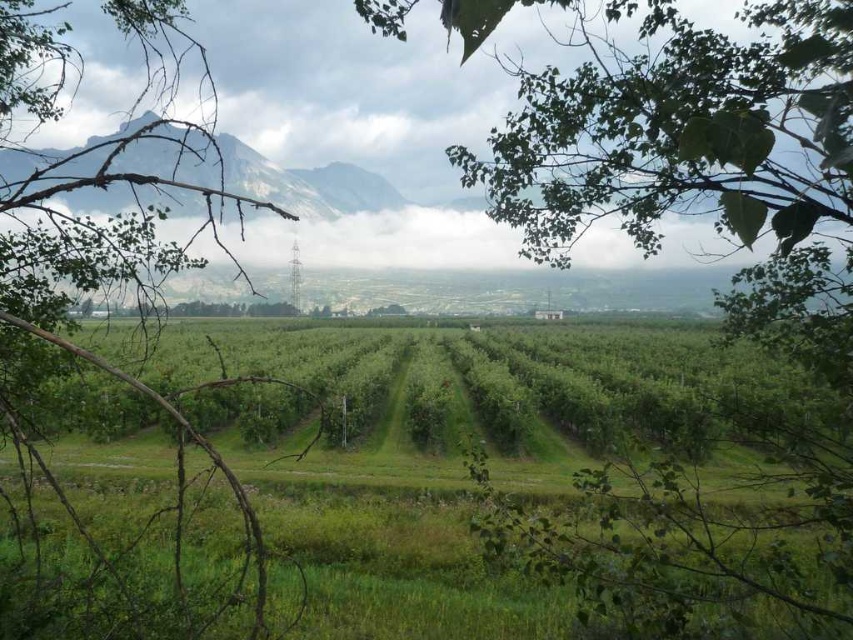
You are a GUI agent. You are given a task and a screenshot of the screen. Output one action in this format:
    pyautogui.click(x=<x>, y=<y>)
    Task: Click on the green leafy branch at left
    
    Given the screenshot: What is the action you would take?
    pyautogui.click(x=103, y=285)

Between green leafy branch at left and gray rocky mountain at upper center, which one is positioned higher?

gray rocky mountain at upper center is higher up.

Is point (82, 180) closer to camera compared to point (344, 193)?

Yes.

At what (x,y) coordinates should I click in order to perform the action: click on green leafy branch at left. Please return your answer as a coordinate pair (x, y). Looking at the image, I should click on (103, 285).

Can you confirm if green leafy tree at center is smaller than gray rocky mountain at upper center?

Indeed, green leafy tree at center has a smaller size compared to gray rocky mountain at upper center.

Based on the photo, which is above, green leafy tree at center or gray rocky mountain at upper center?

gray rocky mountain at upper center is higher up.

Between point (560, 166) and point (364, 204), which one is positioned behind?

Point (364, 204)

The width and height of the screenshot is (853, 640). Identify the location of green leafy tree at center. (693, 156).

Does point (840, 452) lie behind point (32, 356)?

Yes, point (840, 452) is behind point (32, 356).

Between point (469, 33) and point (97, 257), which one is positioned in front?

Point (469, 33)

At what (x,y) coordinates should I click in order to perform the action: click on green leafy tree at center. Please return your answer as a coordinate pair (x, y). The height and width of the screenshot is (640, 853). Looking at the image, I should click on (693, 156).